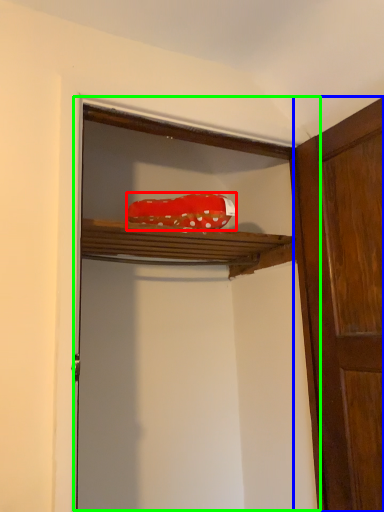
Question: Which object is the farthest from material (highlighted by a red box)? Choose among these: door (highlighted by a blue box) or cabinetry (highlighted by a green box).

Choices:
 (A) door
 (B) cabinetry

Answer: (B)